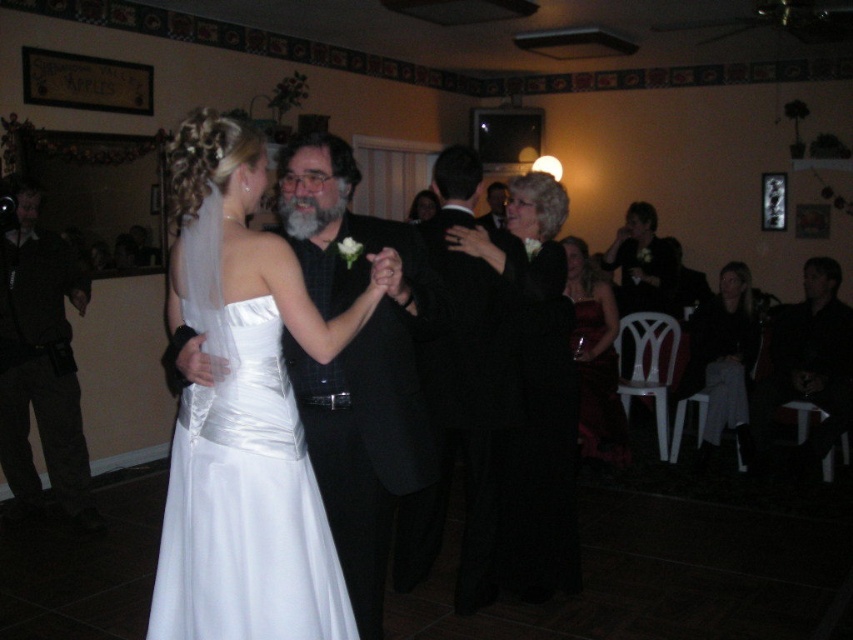
Is point (209, 289) positioned before point (479, 326)?

Yes, point (209, 289) is in front of point (479, 326).

The width and height of the screenshot is (853, 640). Find the location of `satin dress at center`. satin dress at center is located at coordinates (242, 412).

Locate an element on the screen. The image size is (853, 640). satin dress at center is located at coordinates (242, 412).

Who is higher up, black satin suit at center or matte black dress at upper center?

Positioned higher is matte black dress at upper center.

In the scene shown: Measure the distance between point (474, 276) and camera.

Point (474, 276) and camera are 9.38 feet apart.

Where is `black satin suit at center`? The width and height of the screenshot is (853, 640). black satin suit at center is located at coordinates pos(459,392).

Can you confirm if black textured suit at center is positioned below black satin dress at center?

Actually, black textured suit at center is above black satin dress at center.

Describe the element at coordinates (364, 445) in the screenshot. The width and height of the screenshot is (853, 640). I see `black textured suit at center` at that location.

The height and width of the screenshot is (640, 853). In order to click on black textured suit at center in this screenshot , I will do `click(364, 445)`.